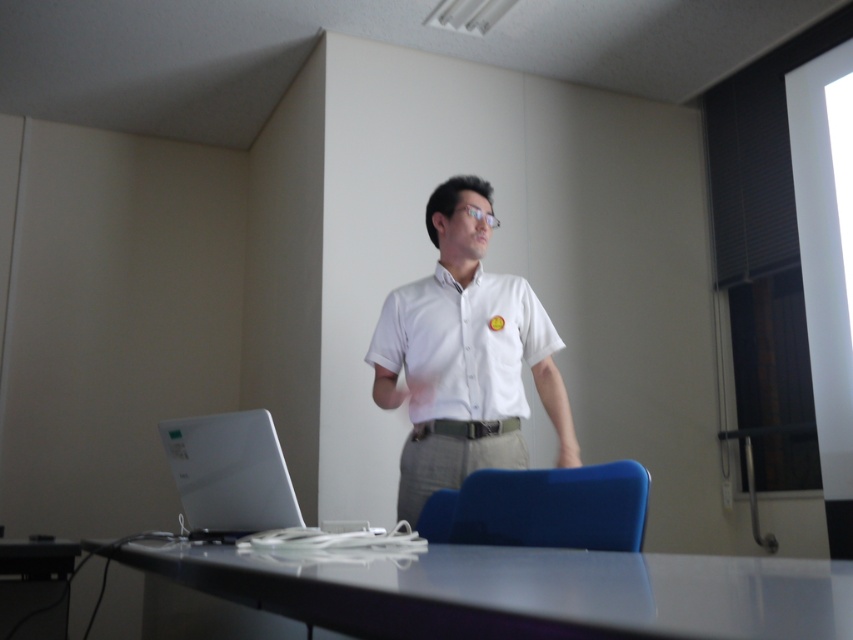
You are sitting in the office and need to place a document on the white glossy table at lower center and the sleek silver laptop at lower left. Based on their positions, which object is located to the right side of the other?

The white glossy table at lower center is to the right of the sleek silver laptop at lower left.

You are sitting in the blue chair behind the desk and want to reach both points on the desk. Which point should you lean forward to reach first, point 1 at point (433,225) or point 2 at point (509,326)?

You should lean forward to reach point 2 at point (509,326) first because point 1 at point (433,225) is behind it.

You are sitting in an office chair and need to reach both the white glossy table at lower center and the white satin shirt at center. Which object is closer to you?

The white glossy table at lower center is closer to you than the white satin shirt at center.